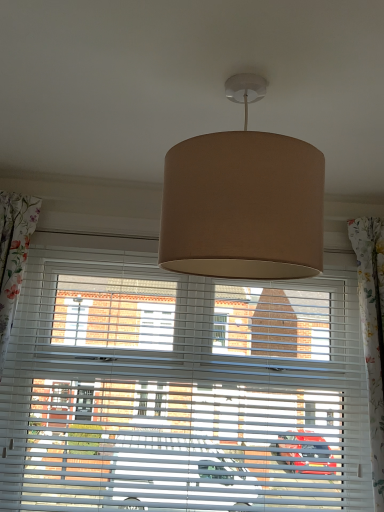
Question: Considering the relative positions of white matte window blind at center and beige fabric lampshade at center in the image provided, is white matte window blind at center to the left of beige fabric lampshade at center from the viewer's perspective?

Choices:
 (A) yes
 (B) no

Answer: (A)

Question: Can beige fabric lampshade at center be found inside white matte window blind at center?

Choices:
 (A) no
 (B) yes

Answer: (A)

Question: Considering the relative sizes of white matte window blind at center and beige fabric lampshade at center in the image provided, is white matte window blind at center wider than beige fabric lampshade at center?

Choices:
 (A) yes
 (B) no

Answer: (B)

Question: Is white matte window blind at center shorter than beige fabric lampshade at center?

Choices:
 (A) no
 (B) yes

Answer: (A)

Question: Is white matte window blind at center looking in the opposite direction of beige fabric lampshade at center?

Choices:
 (A) no
 (B) yes

Answer: (A)

Question: Is white matte window blind at center positioned in front of beige fabric lampshade at center?

Choices:
 (A) no
 (B) yes

Answer: (A)

Question: Considering the relative positions of beige fabric lampshade at center and white matte window blind at center in the image provided, is beige fabric lampshade at center to the left of white matte window blind at center from the viewer's perspective?

Choices:
 (A) no
 (B) yes

Answer: (A)

Question: Is beige fabric lampshade at center positioned with its back to white matte window blind at center?

Choices:
 (A) no
 (B) yes

Answer: (B)

Question: Considering the relative positions of beige fabric lampshade at center and white matte window blind at center in the image provided, is beige fabric lampshade at center in front of white matte window blind at center?

Choices:
 (A) yes
 (B) no

Answer: (A)

Question: Considering the relative sizes of beige fabric lampshade at center and white matte window blind at center in the image provided, is beige fabric lampshade at center shorter than white matte window blind at center?

Choices:
 (A) yes
 (B) no

Answer: (A)

Question: From a real-world perspective, is beige fabric lampshade at center located beneath white matte window blind at center?

Choices:
 (A) yes
 (B) no

Answer: (B)

Question: From a real-world perspective, is beige fabric lampshade at center over white matte window blind at center?

Choices:
 (A) no
 (B) yes

Answer: (B)

Question: Does point (190, 215) appear closer or farther from the camera than point (264, 306)?

Choices:
 (A) closer
 (B) farther

Answer: (A)